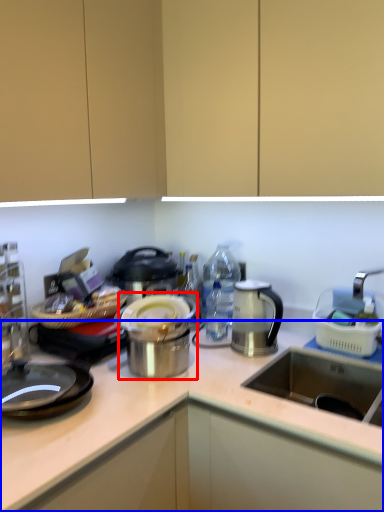
Question: Which object appears farthest to the camera in this image, appliance (highlighted by a red box) or countertop (highlighted by a blue box)?

Choices:
 (A) appliance
 (B) countertop

Answer: (A)